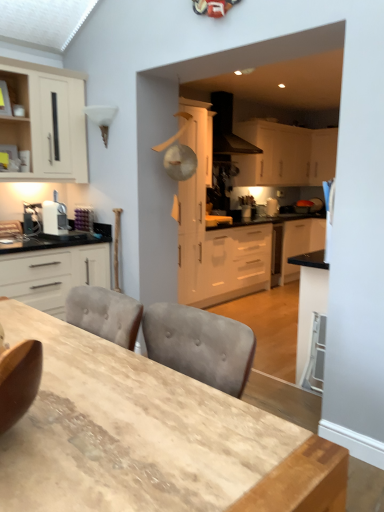
Locate an element on the screen. The width and height of the screenshot is (384, 512). empty space that is ontop of wooden table at center is located at coordinates 111,408.